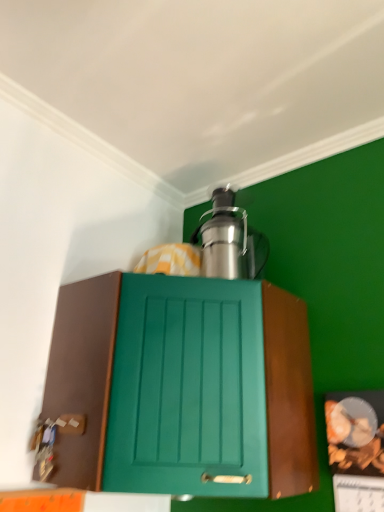
Question: Considering the relative sizes of satin silver coffee maker at upper center and teal matte cabinet at center in the image provided, is satin silver coffee maker at upper center bigger than teal matte cabinet at center?

Choices:
 (A) yes
 (B) no

Answer: (B)

Question: Does satin silver coffee maker at upper center appear on the left side of teal matte cabinet at center?

Choices:
 (A) yes
 (B) no

Answer: (B)

Question: Is satin silver coffee maker at upper center positioned beyond the bounds of teal matte cabinet at center?

Choices:
 (A) no
 (B) yes

Answer: (B)

Question: Is the depth of satin silver coffee maker at upper center greater than that of teal matte cabinet at center?

Choices:
 (A) no
 (B) yes

Answer: (B)

Question: Is satin silver coffee maker at upper center thinner than teal matte cabinet at center?

Choices:
 (A) no
 (B) yes

Answer: (B)

Question: From a real-world perspective, is satin silver coffee maker at upper center under teal matte cabinet at center?

Choices:
 (A) yes
 (B) no

Answer: (B)

Question: Does teal matte cabinet at center come in front of satin silver coffee maker at upper center?

Choices:
 (A) no
 (B) yes

Answer: (B)

Question: Does teal matte cabinet at center appear on the left side of satin silver coffee maker at upper center?

Choices:
 (A) yes
 (B) no

Answer: (A)

Question: From a real-world perspective, is teal matte cabinet at center physically above satin silver coffee maker at upper center?

Choices:
 (A) yes
 (B) no

Answer: (B)

Question: Is teal matte cabinet at center not close to satin silver coffee maker at upper center?

Choices:
 (A) yes
 (B) no

Answer: (B)

Question: Can you confirm if teal matte cabinet at center is smaller than satin silver coffee maker at upper center?

Choices:
 (A) no
 (B) yes

Answer: (A)

Question: Is teal matte cabinet at center at the right side of satin silver coffee maker at upper center?

Choices:
 (A) no
 (B) yes

Answer: (A)

Question: From a real-world perspective, is teal matte cabinet at center above or below satin silver coffee maker at upper center?

Choices:
 (A) below
 (B) above

Answer: (A)